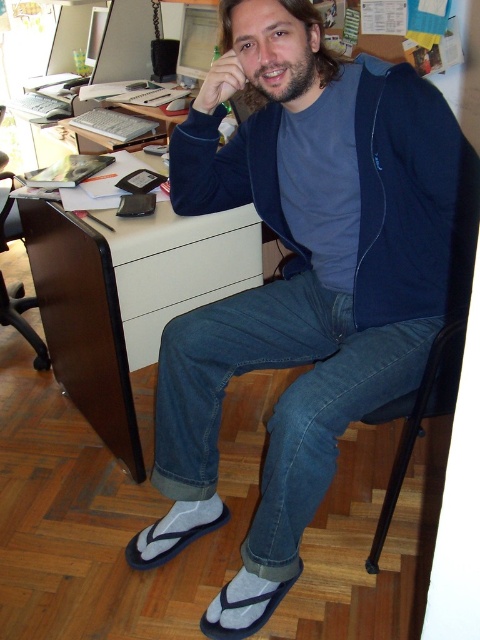
Who is more forward, (180, 125) or (48, 218)?

Point (180, 125) is more forward.

Between blue fleece sweatshirt at center and brown wood desk at center, which one has less height?

blue fleece sweatshirt at center is shorter.

Locate an element on the screen. This screenshot has height=640, width=480. blue fleece sweatshirt at center is located at coordinates (410, 198).

Which is more to the right, blue fleece sweatshirt at center or black plastic chair at lower left?

blue fleece sweatshirt at center

Who is lower down, blue fleece sweatshirt at center or black plastic chair at lower left?

black plastic chair at lower left is lower down.

Is point (188, 163) farther from camera compared to point (36, 369)?

No, it is in front of (36, 369).

Where is `blue fleece sweatshirt at center`? The width and height of the screenshot is (480, 640). blue fleece sweatshirt at center is located at coordinates (410, 198).

Does brown wood desk at center appear under black plastic chair at lower right?

No, brown wood desk at center is not below black plastic chair at lower right.

How much distance is there between brown wood desk at center and black plastic chair at lower right?

brown wood desk at center and black plastic chair at lower right are 80.67 centimeters apart from each other.

This screenshot has height=640, width=480. I want to click on brown wood desk at center, so [127, 298].